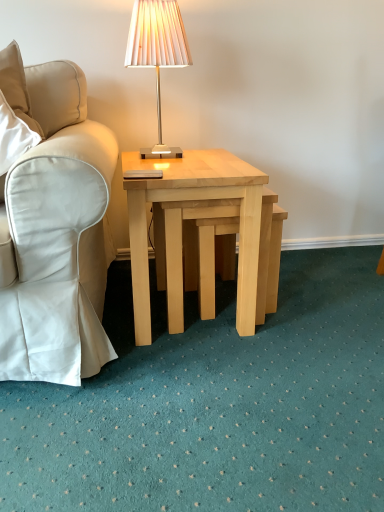
Question: Does white fabric chair at left have a lesser height compared to light wood/natural wood coffee table at center?

Choices:
 (A) yes
 (B) no

Answer: (B)

Question: Is white fabric chair at left smaller than light wood/natural wood coffee table at center?

Choices:
 (A) no
 (B) yes

Answer: (B)

Question: Is white fabric chair at left positioned before light wood/natural wood coffee table at center?

Choices:
 (A) no
 (B) yes

Answer: (B)

Question: Is white fabric chair at left aimed at light wood/natural wood coffee table at center?

Choices:
 (A) yes
 (B) no

Answer: (B)

Question: Is white fabric chair at left further to the viewer compared to light wood/natural wood coffee table at center?

Choices:
 (A) yes
 (B) no

Answer: (B)

Question: Would you say white fabric chair at left is to the left or to the right of natural wood stool at center in the picture?

Choices:
 (A) left
 (B) right

Answer: (A)

Question: Is point (77, 318) positioned closer to the camera than point (210, 292)?

Choices:
 (A) closer
 (B) farther

Answer: (A)

Question: Do you think white fabric chair at left is within natural wood stool at center, or outside of it?

Choices:
 (A) outside
 (B) inside

Answer: (A)

Question: Is white fabric chair at left in front of or behind natural wood stool at center in the image?

Choices:
 (A) front
 (B) behind

Answer: (A)

Question: From a real-world perspective, relative to light wood/natural wood coffee table at center, is matte beige lamp at upper center vertically above or below?

Choices:
 (A) below
 (B) above

Answer: (B)

Question: Is matte beige lamp at upper center to the left or to the right of light wood/natural wood coffee table at center in the image?

Choices:
 (A) left
 (B) right

Answer: (A)

Question: Relative to light wood/natural wood coffee table at center, is matte beige lamp at upper center in front or behind?

Choices:
 (A) front
 (B) behind

Answer: (B)

Question: In terms of size, does matte beige lamp at upper center appear bigger or smaller than light wood/natural wood coffee table at center?

Choices:
 (A) small
 (B) big

Answer: (A)

Question: From the image's perspective, relative to white fabric chair at left, is matte beige lamp at upper center above or below?

Choices:
 (A) above
 (B) below

Answer: (A)

Question: Is matte beige lamp at upper center wider or thinner than white fabric chair at left?

Choices:
 (A) wide
 (B) thin

Answer: (B)